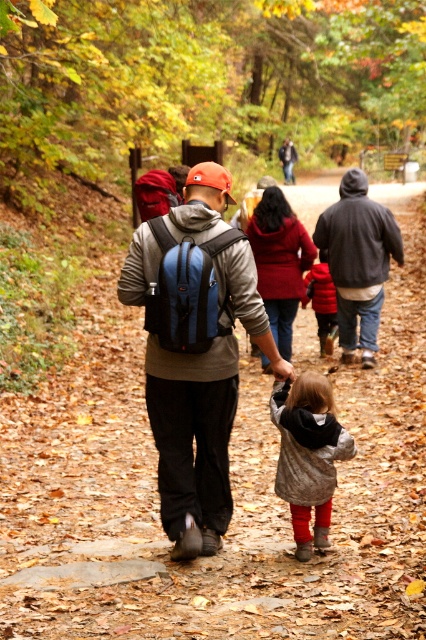
Question: Can you confirm if dark gray hoodie at center is wider than red fleece jacket at center?

Choices:
 (A) no
 (B) yes

Answer: (B)

Question: Based on their relative distances, which object is nearer to the gray wool coat at center?

Choices:
 (A) velvet red coat at center
 (B) red fleece jacket at center

Answer: (A)

Question: Is gray wool coat at center bigger than velvet red coat at center?

Choices:
 (A) yes
 (B) no

Answer: (B)

Question: Can you confirm if matte blue backpack at center is positioned to the left of red fleece jacket at center?

Choices:
 (A) no
 (B) yes

Answer: (B)

Question: Considering the real-world distances, which object is closest to the gray wool coat at center?

Choices:
 (A) velvet red coat at center
 (B) red fleece jacket at center
 (C) dark gray hoodie at center
 (D) matte blue backpack at center

Answer: (D)

Question: Among these objects, which one is farthest from the camera?

Choices:
 (A) velvet red coat at center
 (B) gray wool coat at center
 (C) red fleece jacket at center

Answer: (C)